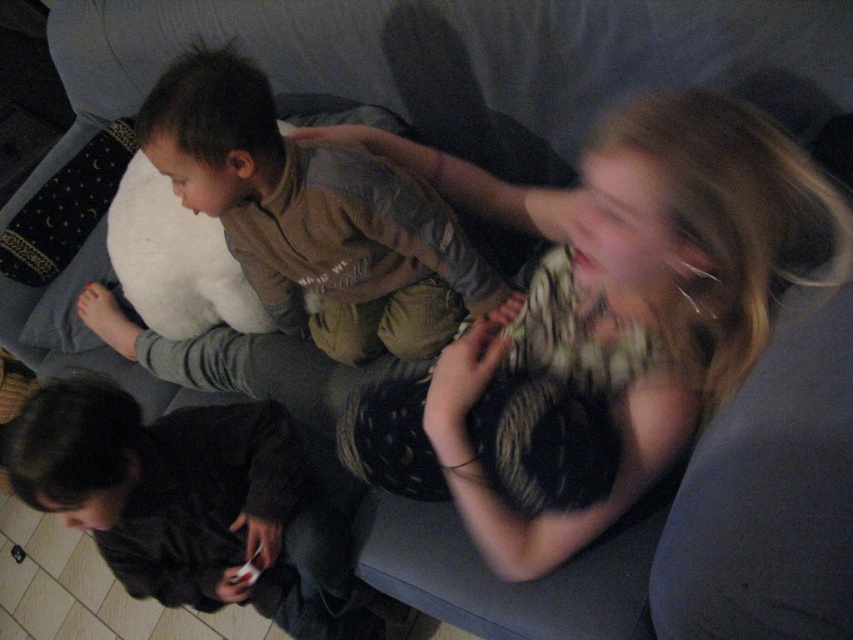
You are a delivery robot with a 12 inch wide package. You need to place it between the brown cotton shirt at upper left and the white matte game controller at lower left. Is there enough space?

The distance between the brown cotton shirt at upper left and the white matte game controller at lower left is 21.67 inches. Since the package is 12 inches wide, there is sufficient space to place it between them.

Based on the scene description, which object is positioned higher in the image? The brown cotton shirt at upper left or the white matte game controller at lower left?

The brown cotton shirt at upper left is positioned higher in the image than the white matte game controller at lower left.

What is located at the coordinates point (316, 218)?

The brown cotton shirt at upper left is located at point (316, 218).